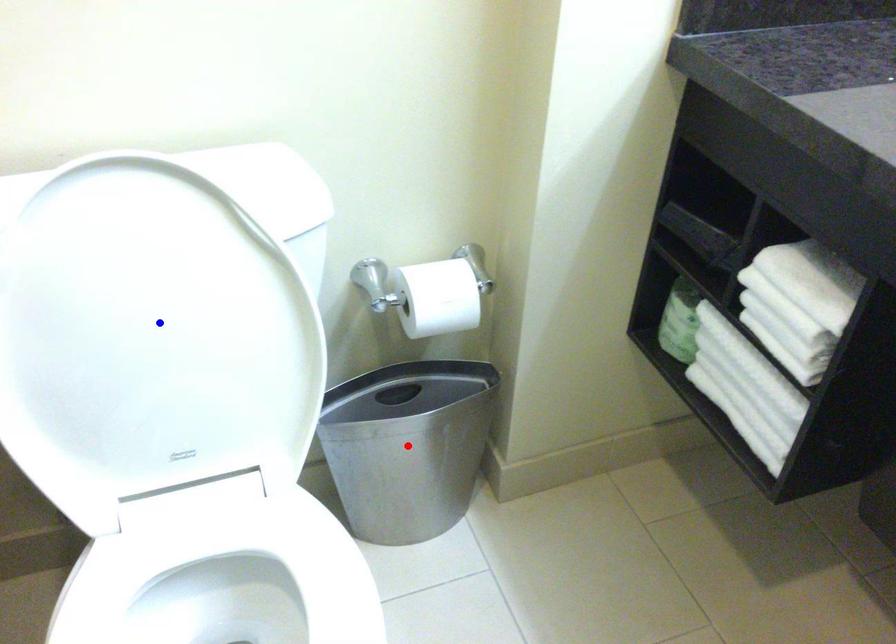
Question: Two points are marked on the image. Which point is closer to the camera?

Choices:
 (A) Blue point is closer.
 (B) Red point is closer.

Answer: (A)